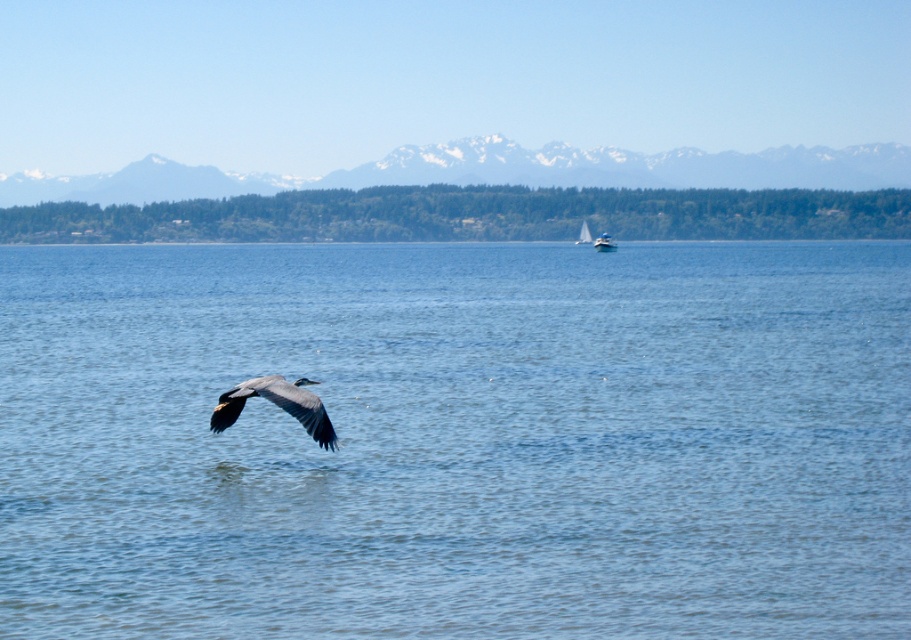
Question: Which is farther from the white sailboat at center?

Choices:
 (A) blue water at center
 (B) white plastic boat at center

Answer: (A)

Question: Is snowy white mountain at upper center above white plastic boat at center?

Choices:
 (A) yes
 (B) no

Answer: (A)

Question: Does blue water at center have a greater width compared to gray matte bird at center?

Choices:
 (A) yes
 (B) no

Answer: (A)

Question: Can you confirm if gray matte bird at center is positioned above white plastic boat at center?

Choices:
 (A) no
 (B) yes

Answer: (A)

Question: Which point is farther to the camera?

Choices:
 (A) (599, 243)
 (B) (251, 381)

Answer: (A)

Question: Which object is positioned closest to the gray matte bird at center?

Choices:
 (A) white sailboat at center
 (B) snowy white mountain at upper center
 (C) blue water at center
 (D) white plastic boat at center

Answer: (C)